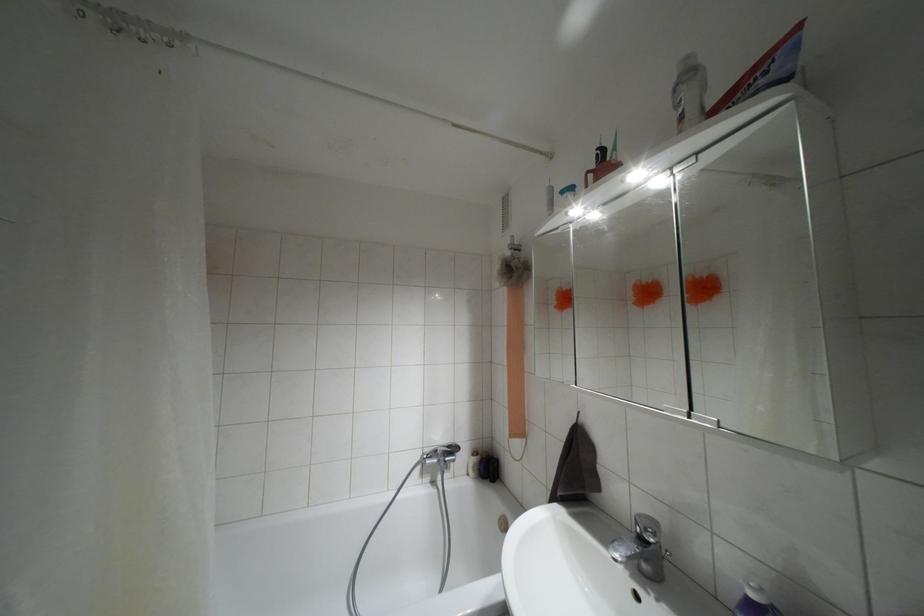
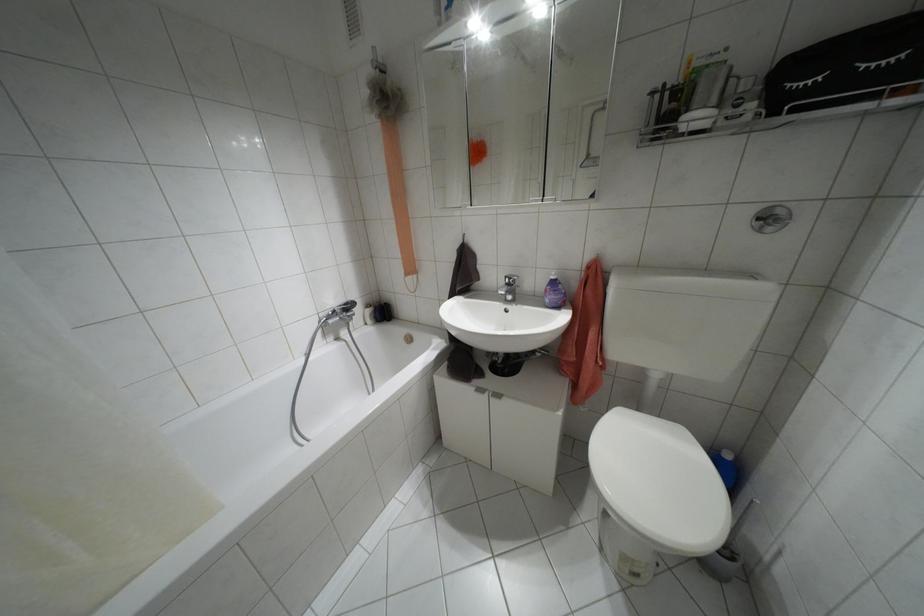
Based on the continuous images, in which direction is the camera rotating?

The camera's rotation is toward right-down.